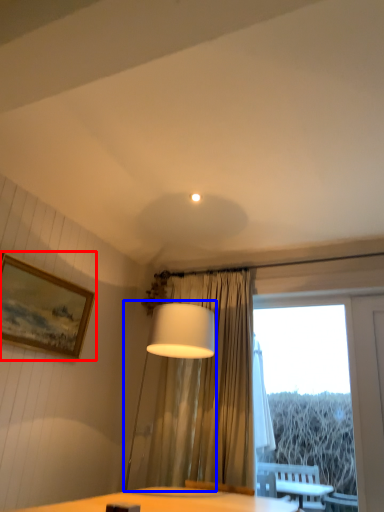
Question: Which object is closer to the camera taking this photo, picture frame (highlighted by a red box) or table lamp (highlighted by a blue box)?

Choices:
 (A) picture frame
 (B) table lamp

Answer: (B)